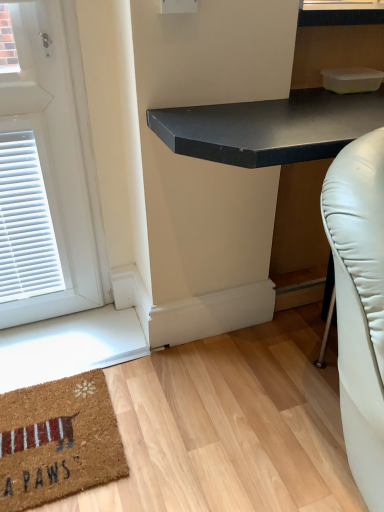
Where is `free space underneath brown coir mat at lower left (from a real-world perspective)`? This screenshot has height=512, width=384. free space underneath brown coir mat at lower left (from a real-world perspective) is located at coordinates (64, 432).